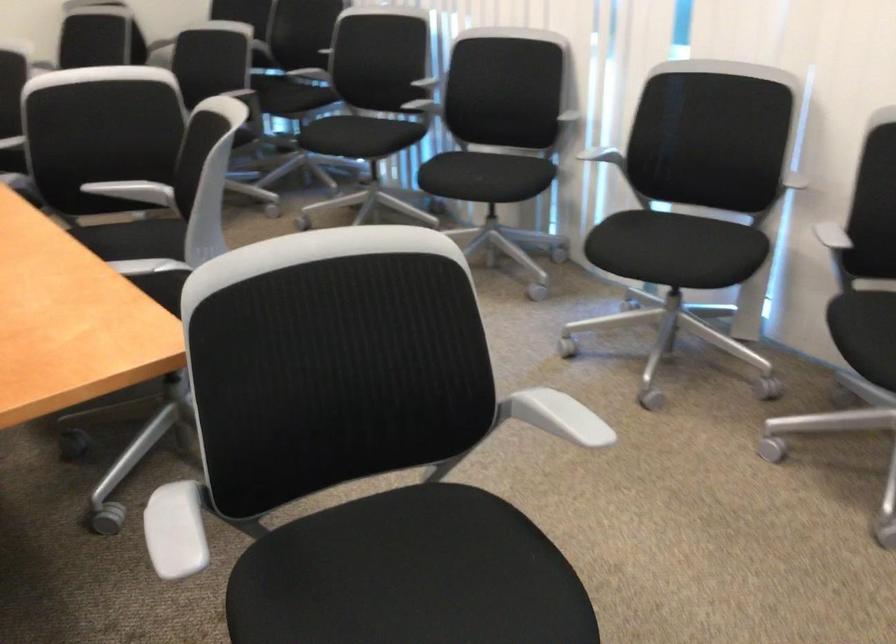
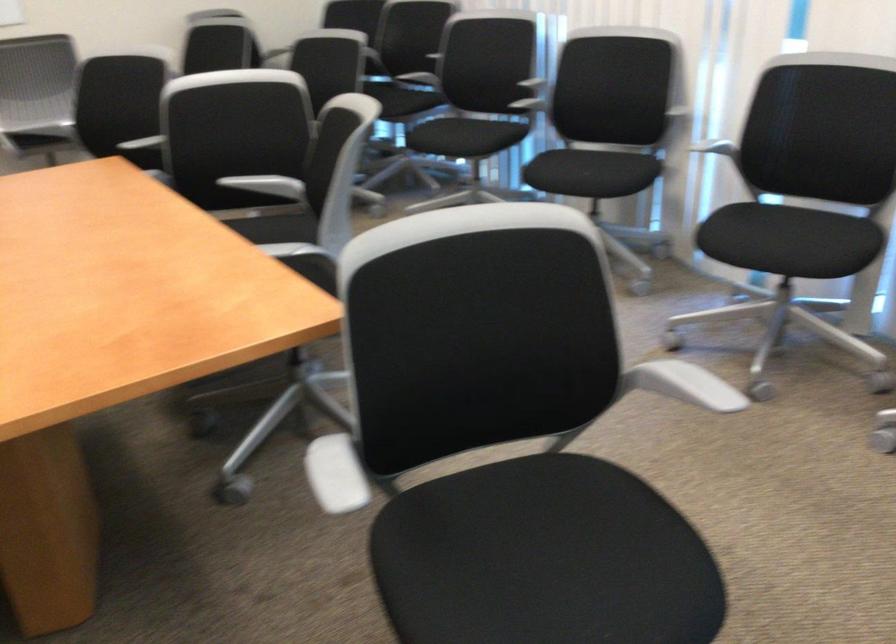
Locate, in the second image, the point that corresponds to (x=608, y=158) in the first image.

(718, 149)